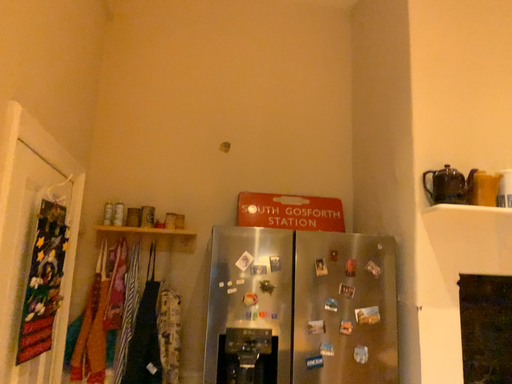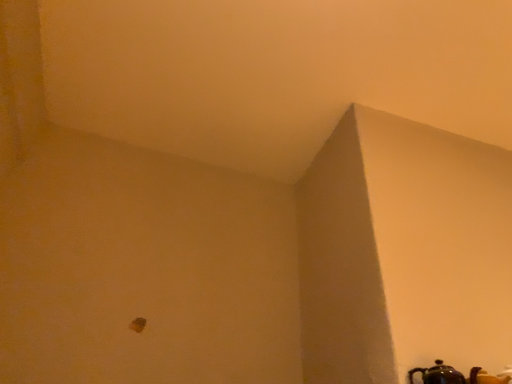
Question: Which way did the camera rotate in the video?

Choices:
 (A) rotated upward
 (B) rotated downward

Answer: (A)